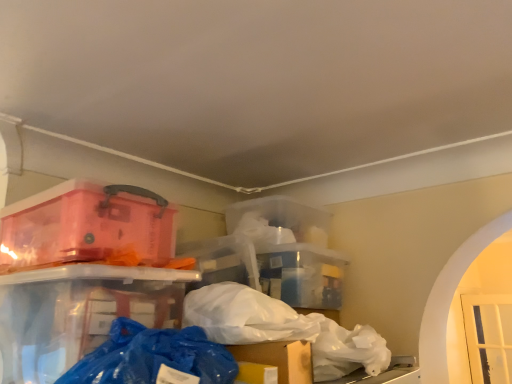
Question: Should I look upward or downward to see transparent plastic container at upper left?

Choices:
 (A) down
 (B) up

Answer: (A)

Question: Is transparent plastic container at upper left outside blue plastic bag at lower center, positioned as the first plastic bag in left-to-right order?

Choices:
 (A) yes
 (B) no

Answer: (A)

Question: Is transparent plastic container at upper left wider than blue plastic bag at lower center, acting as the first plastic bag starting from the front?

Choices:
 (A) yes
 (B) no

Answer: (A)

Question: From the image's perspective, is transparent plastic container at upper left under blue plastic bag at lower center, the second plastic bag from the back?

Choices:
 (A) yes
 (B) no

Answer: (B)

Question: Is transparent plastic container at upper left next to blue plastic bag at lower center, the second plastic bag from the back, and touching it?

Choices:
 (A) no
 (B) yes

Answer: (A)

Question: Does transparent plastic container at upper left have a lesser height compared to blue plastic bag at lower center, acting as the first plastic bag starting from the front?

Choices:
 (A) no
 (B) yes

Answer: (A)

Question: Is transparent plastic container at upper left behind blue plastic bag at lower center, positioned as the first plastic bag in left-to-right order?

Choices:
 (A) yes
 (B) no

Answer: (A)

Question: Are white matte plastic bag at center, marked as the second plastic bag in a front-to-back arrangement, and blue plastic bag at lower center, acting as the first plastic bag starting from the front, far apart?

Choices:
 (A) yes
 (B) no

Answer: (B)

Question: From the image's perspective, is white matte plastic bag at center, the first plastic bag viewed from the right, located above blue plastic bag at lower center, acting as the first plastic bag starting from the front?

Choices:
 (A) no
 (B) yes

Answer: (A)

Question: Does white matte plastic bag at center, marked as the second plastic bag in a front-to-back arrangement, appear on the right side of blue plastic bag at lower center, positioned as the first plastic bag in left-to-right order?

Choices:
 (A) no
 (B) yes

Answer: (B)

Question: Is white matte plastic bag at center, marked as the second plastic bag in a front-to-back arrangement, placed right next to blue plastic bag at lower center, acting as the second plastic bag starting from the right?

Choices:
 (A) no
 (B) yes

Answer: (A)

Question: Does white matte plastic bag at center, the first plastic bag viewed from the right, have a greater width compared to blue plastic bag at lower center, acting as the first plastic bag starting from the front?

Choices:
 (A) no
 (B) yes

Answer: (B)

Question: Is white matte plastic bag at center, marked as the second plastic bag in a front-to-back arrangement, further to camera compared to blue plastic bag at lower center, positioned as the first plastic bag in left-to-right order?

Choices:
 (A) no
 (B) yes

Answer: (B)

Question: Can you confirm if blue plastic bag at lower center, the second plastic bag from the back, is taller than white matte plastic bag at center, placed as the 1th plastic bag when sorted from back to front?

Choices:
 (A) no
 (B) yes

Answer: (A)